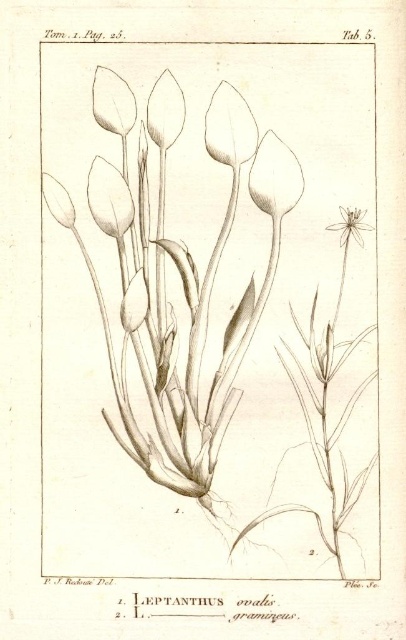
You are examining the botanical illustration of Leptanthus ovalis and L. gramineus. You notice two points labeled as point 1 at coordinates (x=272, y=180) and point 2 at (x=123, y=84). Which point is closer to your viewpoint?

Point 1 at coordinates (x=272, y=180) is closer to your viewpoint because it is further to the viewer than point 2 at (x=123, y=84).

Based on the botanical illustration provided, where exactly is the matte white petal at center located in terms of coordinates?

The matte white petal at center is located at the coordinates point (274, 177).